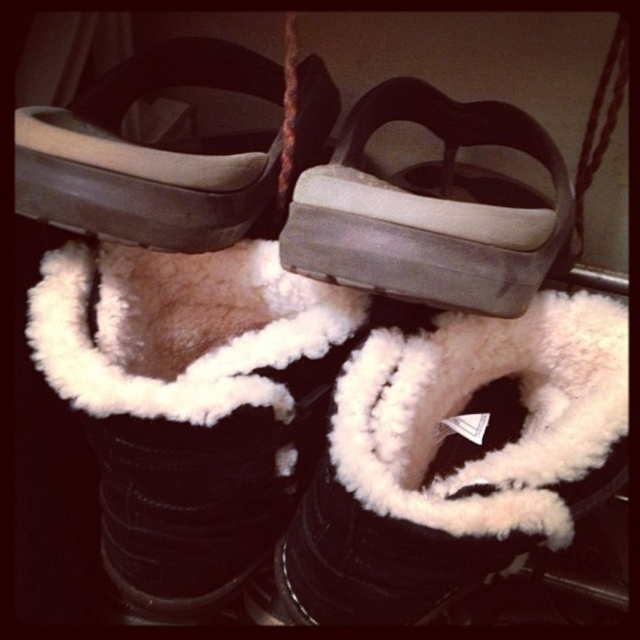
Question: Is gray rubber sandal at center wider than matte gray sandal at upper center?

Choices:
 (A) no
 (B) yes

Answer: (A)

Question: Which object is closer to the camera taking this photo?

Choices:
 (A) gray rubber sandal at center
 (B) white fluffy boot at center

Answer: (B)

Question: Which object is positioned farthest from the white fluffy boot at center?

Choices:
 (A) gray rubber sandal at center
 (B) matte gray sandal at upper center

Answer: (B)

Question: Is white fluffy boot at center above gray rubber sandal at center?

Choices:
 (A) yes
 (B) no

Answer: (B)

Question: Which is nearer to the gray rubber sandal at center?

Choices:
 (A) white fluffy boot at center
 (B) matte gray sandal at upper center

Answer: (A)

Question: Can you confirm if gray rubber sandal at center is smaller than matte gray sandal at upper center?

Choices:
 (A) no
 (B) yes

Answer: (B)